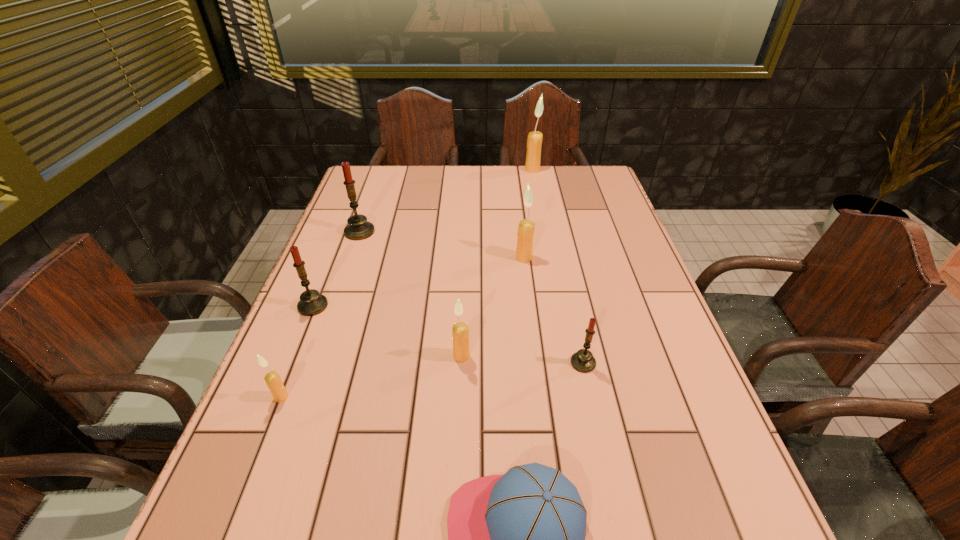
The image size is (960, 540). Identify the location of the smallest red candle. (583, 361).

You are a GUI agent. You are given a task and a screenshot of the screen. Output one action in this format:
    pyautogui.click(x=<x>, y=<y>)
    Task: Click on the nearest red candle
    
    Given the screenshot: What is the action you would take?
    pyautogui.click(x=583, y=361)

The image size is (960, 540). Identify the location of the leftmost cream candle. (272, 379).

You are a GUI agent. You are given a task and a screenshot of the screen. Output one action in this format:
    pyautogui.click(x=<x>, y=<y>)
    Task: Click on the smallest cream candle
    The width and height of the screenshot is (960, 540).
    Given the screenshot: What is the action you would take?
    pyautogui.click(x=272, y=379)

Image resolution: width=960 pixels, height=540 pixels. I want to click on vacant area situated 0.090m on the left of the farthest cream candle, so click(500, 170).

In order to click on free space located on the back of the farthest red candle in this screenshot , I will do `click(374, 191)`.

The height and width of the screenshot is (540, 960). Identify the location of vacant region located on the left of the second cream candle from right to left. (497, 258).

Identify the location of vacant space situated on the back of the fourth nearest candle. The width and height of the screenshot is (960, 540). (348, 219).

At what (x,y) coordinates should I click in order to perform the action: click on vacant area situated on the front of the fourth candle from right to left. Please return your answer as a coordinate pair (x, y). Looking at the image, I should click on (454, 539).

Image resolution: width=960 pixels, height=540 pixels. What are the coordinates of `vacant space situated 0.360m on the left of the nearest red candle` in the screenshot? It's located at (400, 363).